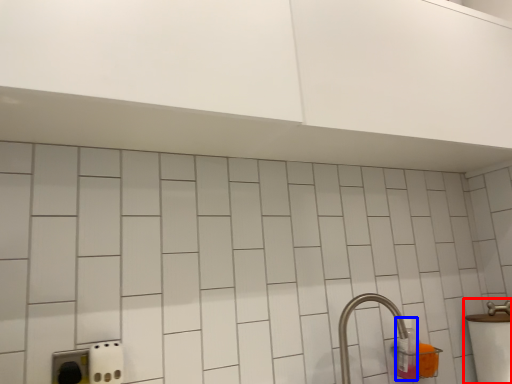
Question: Which of the following is the farthest to the observer, sink (highlighted by a red box) or bottle (highlighted by a blue box)?

Choices:
 (A) sink
 (B) bottle

Answer: (B)